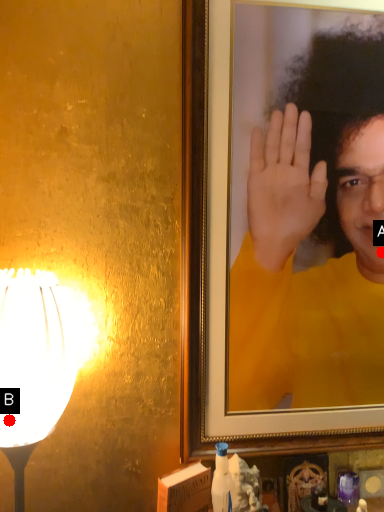
Question: Two points are circled on the image, labeled by A and B beside each circle. Which point is closer to the camera taking this photo?

Choices:
 (A) A is closer
 (B) B is closer

Answer: (B)